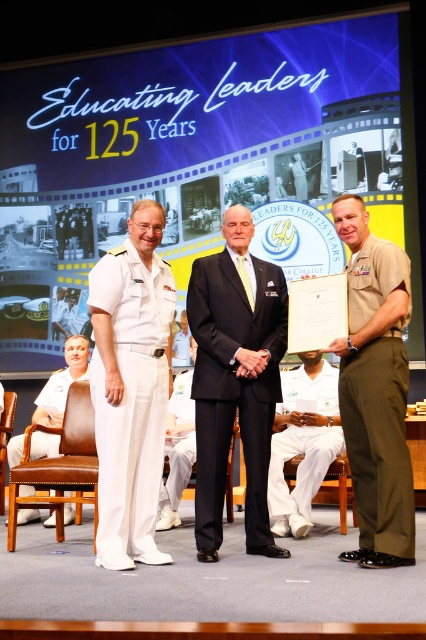
Question: Is white cotton uniform at lower center positioned behind white uniform at left?

Choices:
 (A) yes
 (B) no

Answer: (B)

Question: Can you confirm if black suit at center is positioned to the right of white cotton uniform at lower center?

Choices:
 (A) no
 (B) yes

Answer: (A)

Question: From the image, what is the correct spatial relationship of white cotton pants at left in relation to white cotton uniform at lower center?

Choices:
 (A) right
 (B) left

Answer: (B)

Question: Which point is farther to the camera?

Choices:
 (A) white cotton uniform at lower center
 (B) white cotton pants at center
 (C) white uniform at left

Answer: (C)

Question: Which object is positioned closest to the white cotton pants at center?

Choices:
 (A) olive green fabric pants at right
 (B) white cotton uniform at lower center
 (C) white cotton pants at left

Answer: (B)

Question: Which point appears farthest from the camera in this image?

Choices:
 (A) click(x=155, y=380)
 (B) click(x=186, y=468)
 (C) click(x=408, y=321)

Answer: (B)